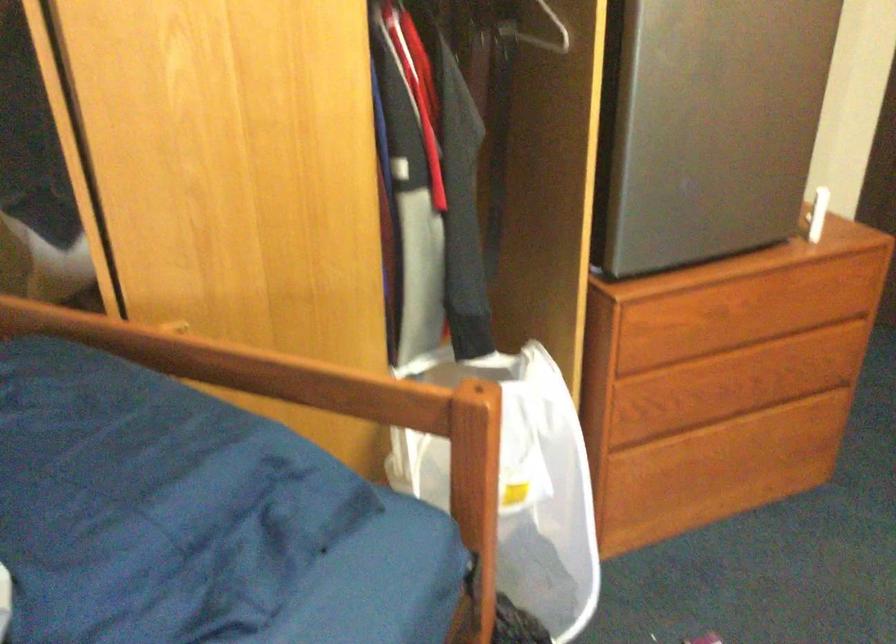
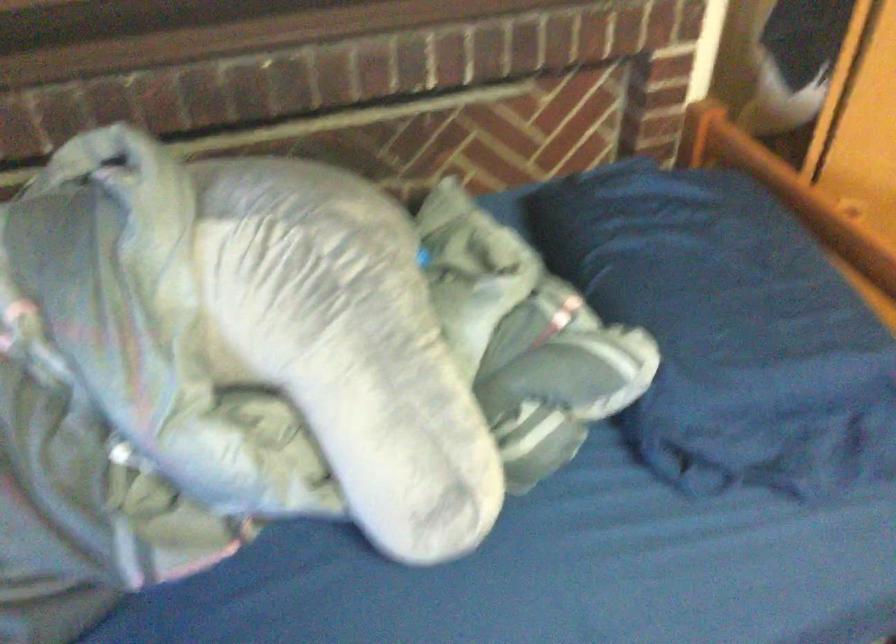
The images are taken continuously from a first-person perspective. In which direction is your viewpoint rotating?

The camera's rotation is toward left-down.